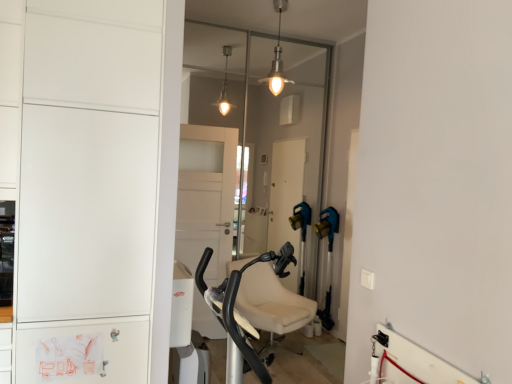
Question: Considering the positions of white matte cabinet at left and transparent glass door at center in the image, is white matte cabinet at left wider or thinner than transparent glass door at center?

Choices:
 (A) thin
 (B) wide

Answer: (B)

Question: Visually, is white matte cabinet at left positioned to the left or to the right of transparent glass door at center?

Choices:
 (A) right
 (B) left

Answer: (B)

Question: Estimate the real-world distances between objects in this image. Which object is farther from the white matte cabinet at left?

Choices:
 (A) metallic pendant light at upper center
 (B) transparent glass door at center

Answer: (B)

Question: Estimate the real-world distances between objects in this image. Which object is closer to the transparent glass door at center?

Choices:
 (A) white matte cabinet at left
 (B) metallic pendant light at upper center

Answer: (B)